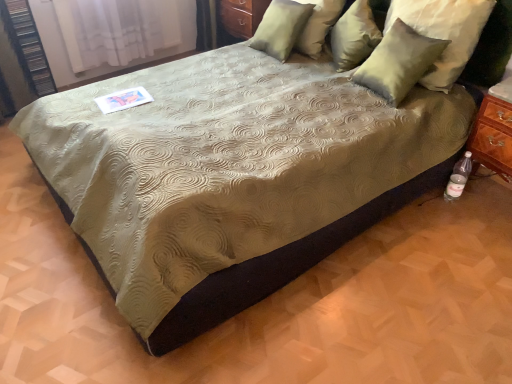
Where is `vacant area located to the right-hand side of clear plastic bottle at lower right`? vacant area located to the right-hand side of clear plastic bottle at lower right is located at coordinates (480, 199).